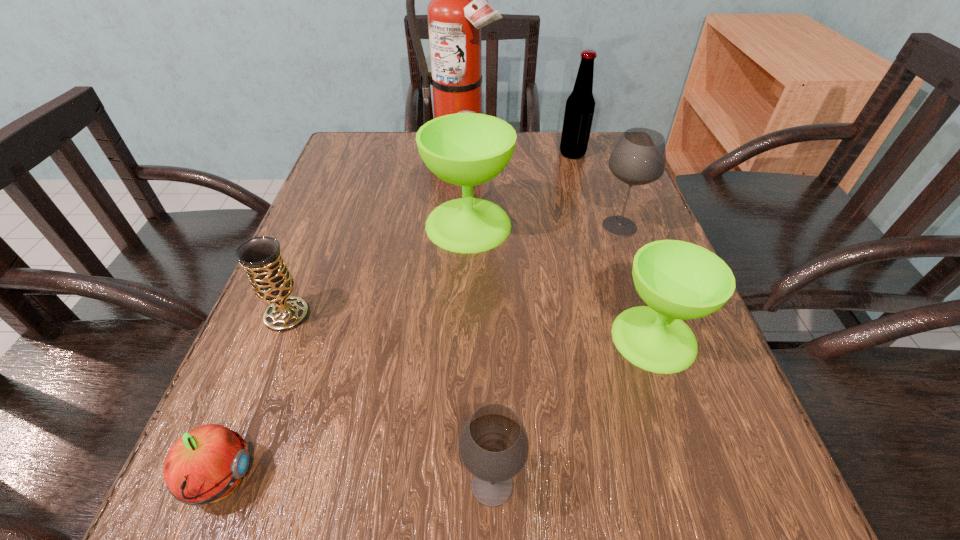
Where is `the left gray wineglass`? The width and height of the screenshot is (960, 540). the left gray wineglass is located at coordinates 494,446.

Find the location of `chalice`. chalice is located at coordinates (271, 281).

At what (x,y) coordinates should I click in order to perform the action: click on apple. Please return your answer as a coordinate pair (x, y). Looking at the image, I should click on (206, 464).

The image size is (960, 540). I want to click on free region located from the nozzle of the fire extinguisher, so click(x=457, y=173).

Where is `free region located on the right of the beer bottle`? The width and height of the screenshot is (960, 540). free region located on the right of the beer bottle is located at coordinates tap(610, 154).

Identify the location of free space located on the back of the farther green wineglass. (470, 165).

I want to click on vacant position located on the back of the right gray wineglass, so 592,152.

Image resolution: width=960 pixels, height=540 pixels. What are the coordinates of `vacant space located on the front of the smaller green wineglass` in the screenshot? It's located at [x=684, y=423].

This screenshot has height=540, width=960. In order to click on vacant position located 0.340m on the back of the nearest wineglass in this screenshot , I will do `click(489, 275)`.

Where is `free location located 0.250m on the front of the chalice`? free location located 0.250m on the front of the chalice is located at coordinates (217, 490).